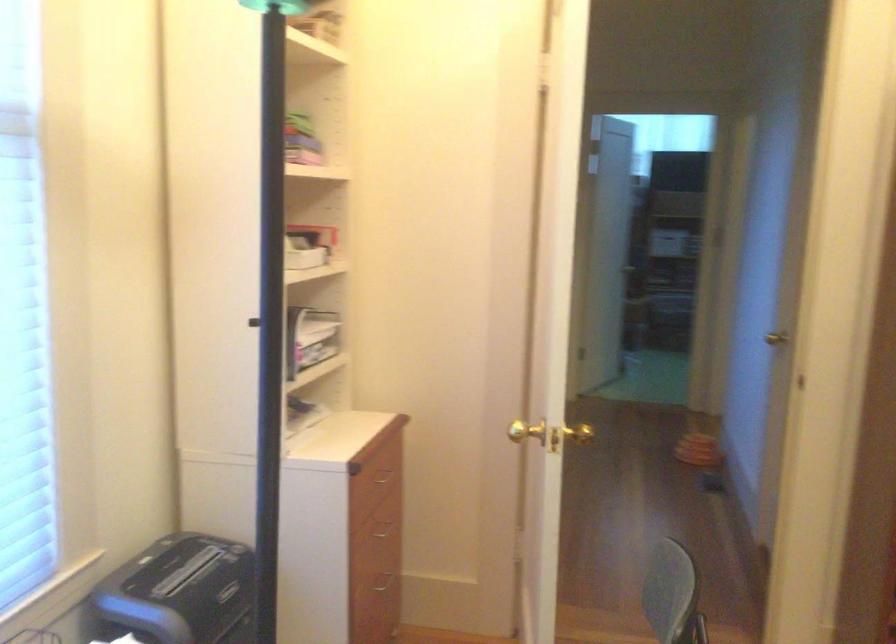
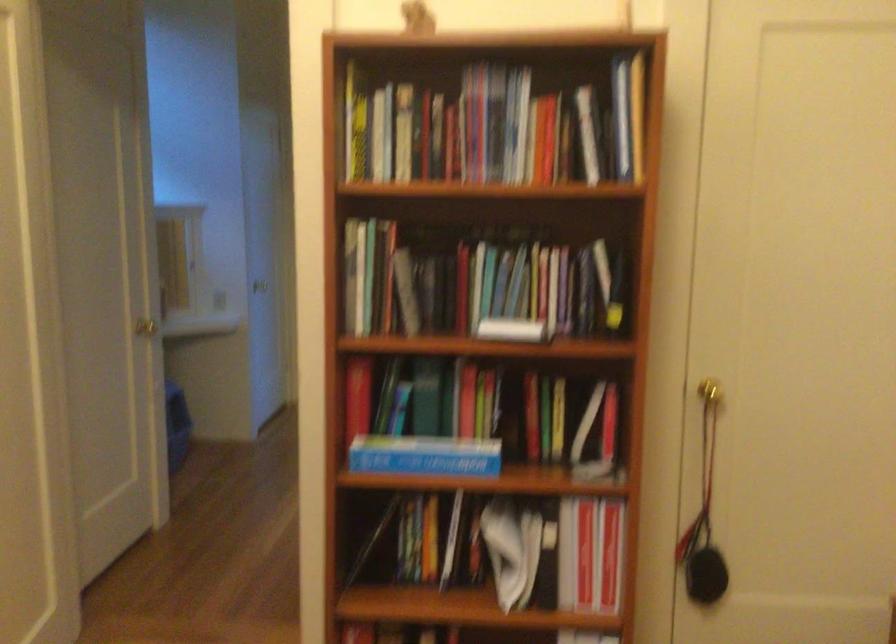
Question: What movement of the cameraman would produce the second image?

Choices:
 (A) Left
 (B) Right
 (C) Forward
 (D) Backward

Answer: (B)